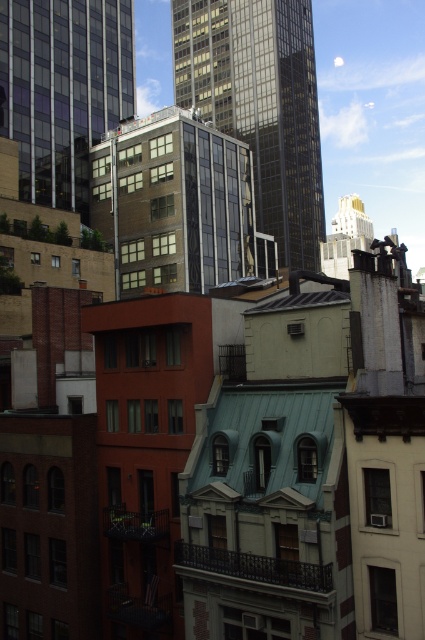
You are standing in the urban scene and want to take a photo. There are two points of interest marked as point (243,60) and point (167,113). Which point will appear closer to the camera in your photo?

Point (167,113) will appear closer to the camera in the photo because it is physically closer to the viewer than point (243,60), which is further away.

Consider the image. You are an architect analyzing the urban skyline. You notice the glassy reflective skyscraper at center and the matte glass building at upper left. Which of these two buildings is bigger in size?

The glassy reflective skyscraper at center is larger in size compared to the matte glass building at upper left according to the description.

You are an architect analyzing the urban skyline. You observe the green glass building at center and the matte glass building at upper left. Which building has a lower height?

The green glass building at center is not as tall as the matte glass building at upper left, so the green glass building at center has a lower height.